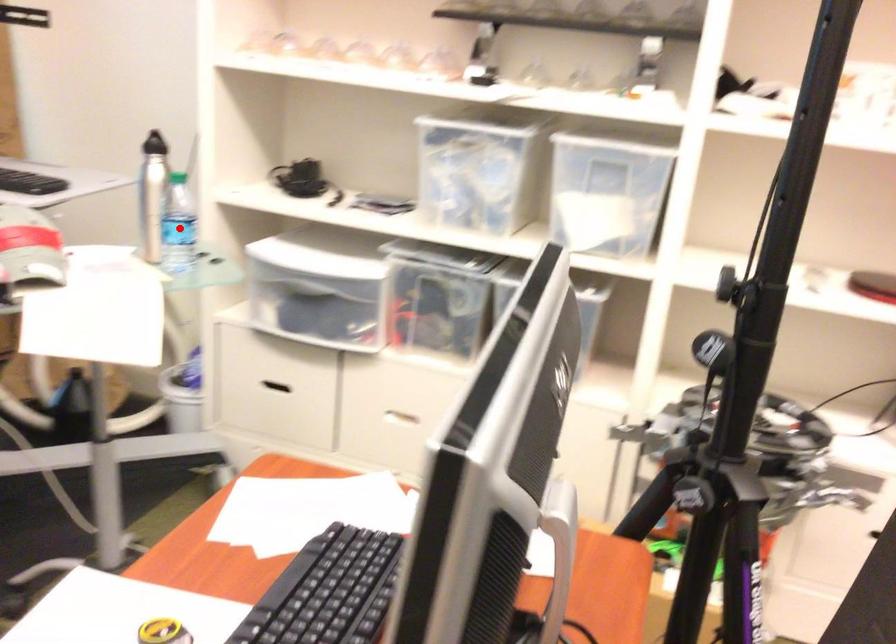
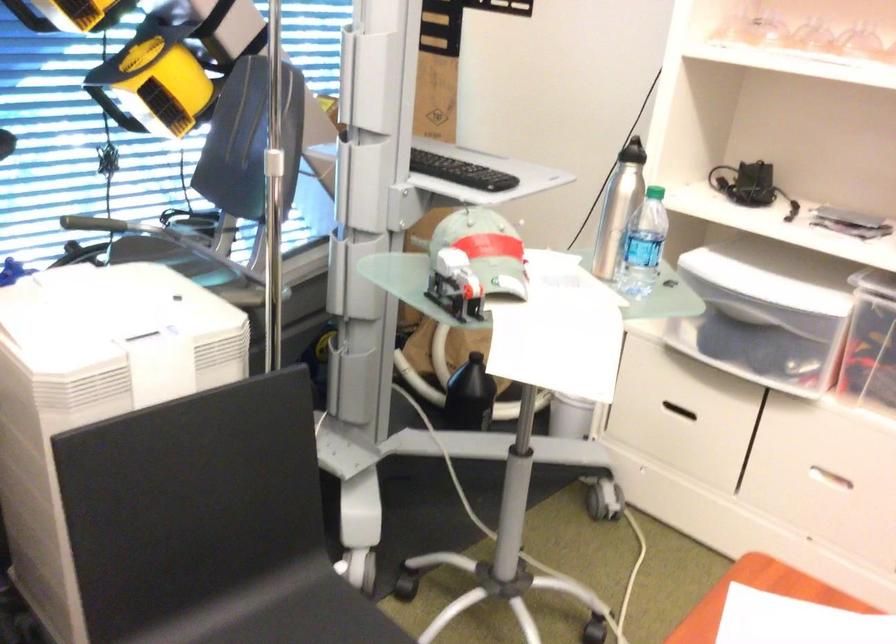
Question: I am providing you with two images of the same scene from different viewpoints. Image1 has a red point marked. In image2, the corresponding 3D location appears at what relative position? Reply with the corresponding letter.

Choices:
 (A) Closer
 (B) Farther

Answer: (A)